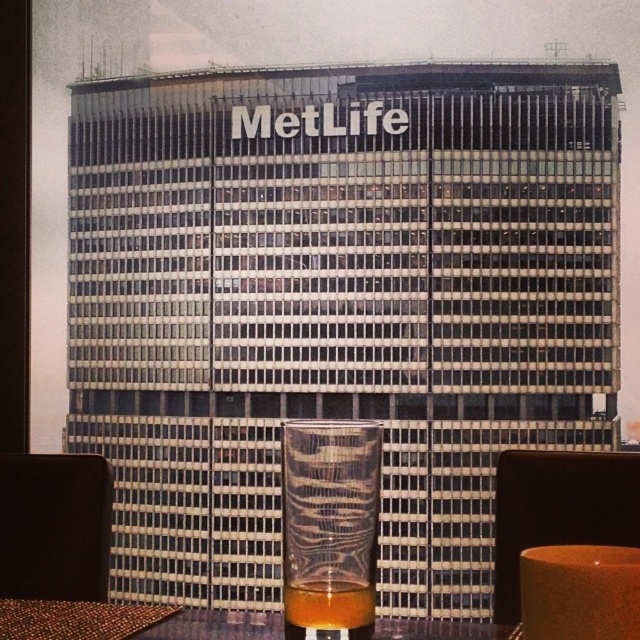
Consider the image. Who is higher up, translucent glass at center or brown woven table at lower left?

→ translucent glass at center is above.

Can you confirm if translucent glass at center is positioned to the right of brown woven table at lower left?

Indeed, translucent glass at center is positioned on the right side of brown woven table at lower left.

Who is more forward, (342, 563) or (92, 628)?

Point (342, 563) is more forward.

Locate an element on the screen. Image resolution: width=640 pixels, height=640 pixels. translucent glass at center is located at coordinates pos(330,524).